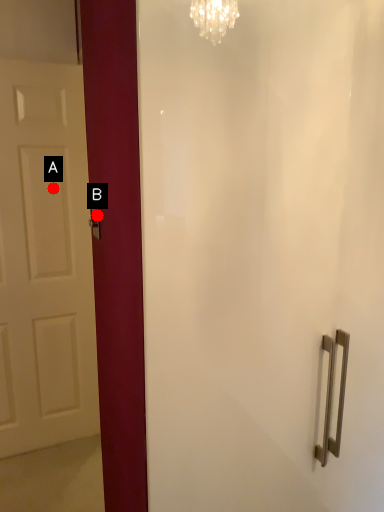
Question: Two points are circled on the image, labeled by A and B beside each circle. Which point is farther from the camera taking this photo?

Choices:
 (A) A is further
 (B) B is further

Answer: (A)